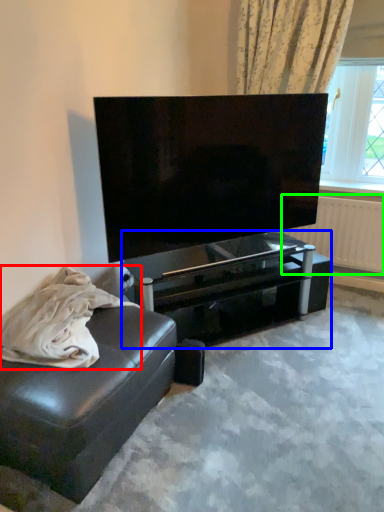
Question: Which object is positioned closest to material (highlighted by a red box)? Select from table (highlighted by a blue box) and radiator (highlighted by a green box).

Choices:
 (A) table
 (B) radiator

Answer: (A)